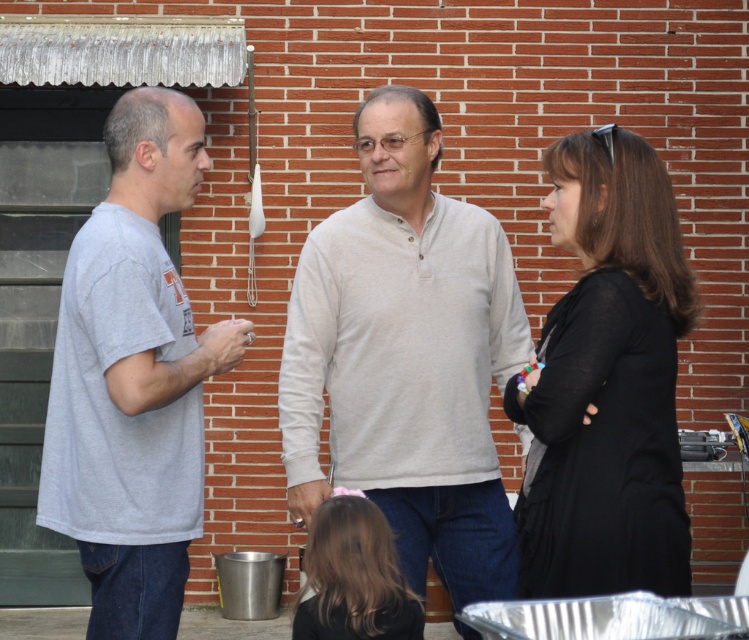
Question: Can you confirm if gray t-shirt at left is positioned below smooth brown hair at lower center?

Choices:
 (A) yes
 (B) no

Answer: (B)

Question: Based on their relative distances, which object is nearer to the light gray cotton shirt at center?

Choices:
 (A) black matte coat at center right
 (B) gray t-shirt at left

Answer: (B)

Question: Does black matte coat at center right have a lesser width compared to smooth brown hair at lower center?

Choices:
 (A) no
 (B) yes

Answer: (A)

Question: Which point is closer to the camera taking this photo?

Choices:
 (A) (175, 547)
 (B) (306, 612)

Answer: (A)

Question: Does light gray cotton shirt at center have a smaller size compared to smooth brown hair at lower center?

Choices:
 (A) no
 (B) yes

Answer: (A)

Question: Considering the real-world distances, which object is closest to the gray t-shirt at left?

Choices:
 (A) smooth brown hair at lower center
 (B) black matte coat at center right

Answer: (A)